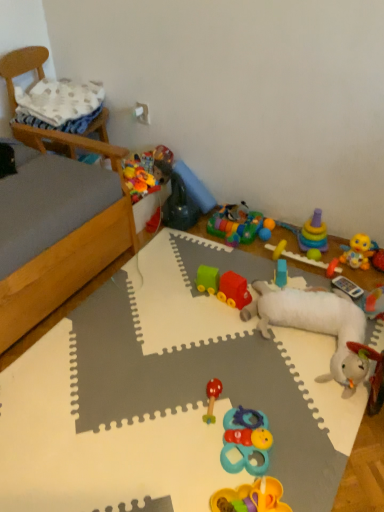
Image resolution: width=384 pixels, height=512 pixels. Identify the location of free location in front of multicolored plastic toy at upper right, which is counted as the sixth toy, starting from the bottom. (310, 280).